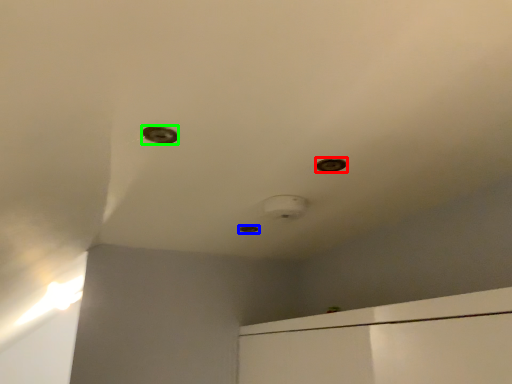
Question: Based on their relative distances, which object is nearer to hole (highlighted by a red box)? Choose from hole (highlighted by a blue box) and hole (highlighted by a green box).

Choices:
 (A) hole
 (B) hole

Answer: (B)